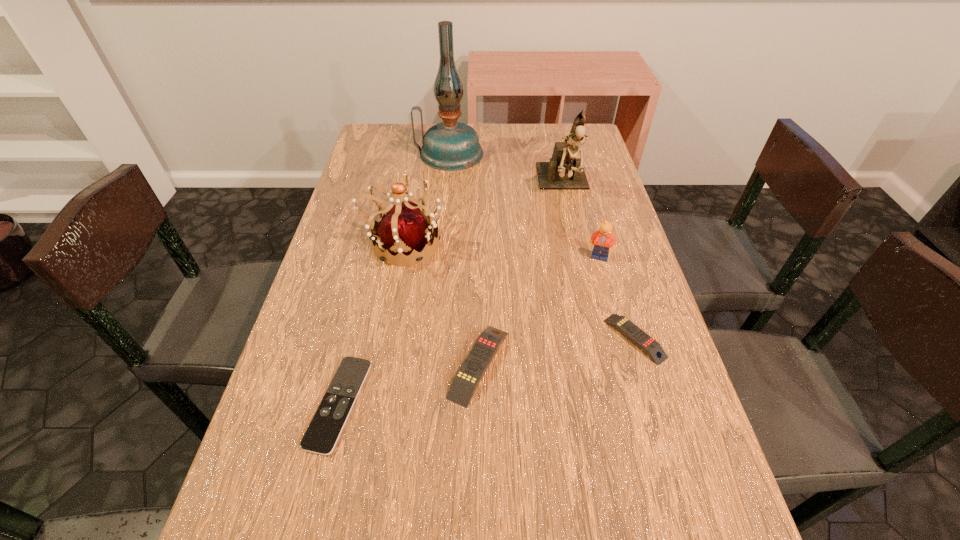
What are the coordinates of `object that is positioned at the far edge` in the screenshot? It's located at (450, 145).

Locate an element on the screen. This screenshot has height=540, width=960. tiara present at the left edge is located at coordinates (404, 229).

This screenshot has height=540, width=960. In order to click on remote control present at the left edge in this screenshot , I will do `click(328, 422)`.

The width and height of the screenshot is (960, 540). What are the coordinates of `figurine that is positioned at the right edge` in the screenshot? It's located at (564, 171).

You are a GUI agent. You are given a task and a screenshot of the screen. Output one action in this format:
    pyautogui.click(x=<x>, y=<y>)
    Task: Click on the Lego at the right edge
    
    Given the screenshot: What is the action you would take?
    pyautogui.click(x=604, y=238)

Locate an element on the screen. remote control that is at the right edge is located at coordinates (637, 336).

Where is `free space at the far edge of the desktop`? The width and height of the screenshot is (960, 540). free space at the far edge of the desktop is located at coordinates (414, 146).

Locate an element on the screen. The height and width of the screenshot is (540, 960). vacant space at the left edge of the desktop is located at coordinates (311, 493).

Where is `vacant space at the right edge of the desktop`? vacant space at the right edge of the desktop is located at coordinates (574, 235).

You are a GUI agent. You are given a task and a screenshot of the screen. Output one action in this format:
    pyautogui.click(x=<x>, y=<y>)
    Task: Click on the free point between the left yellow remote control and the tallest object
    This screenshot has width=960, height=540.
    Given the screenshot: What is the action you would take?
    pyautogui.click(x=465, y=259)